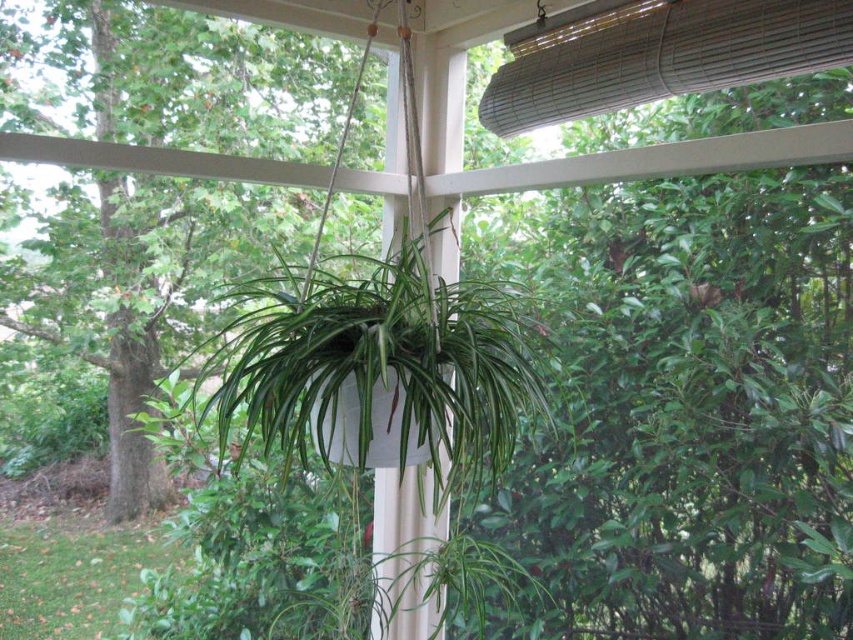
You are standing on the porch and want to hang a new wind chime between the green leafy tree at center and the bamboo blind at upper center. The wind chime requires 6 feet of space to hang properly. Is there enough space between them to install it?

The distance between the green leafy tree at center and the bamboo blind at upper center is 7.28 feet, which is more than the required 6 feet. Therefore, there is enough space to install the wind chime between them.

You are a gardener who wants to ensure the green matte hanging plant at center doesn not obstruct the view through the bamboo blind at upper center. Based on their sizes, is there a risk that the plant might block the blind?

The green matte hanging plant at center has a greater height compared to bamboo blind at upper center, so there is a risk that the plant might block the blind.

You are standing on the porch and want to water the green leafy tree at center and the green matte hanging plant at center. Which one is closer to the left side of the porch?

The green leafy tree at center is positioned on the left side of green matte hanging plant at center, so it is closer to the left side of the porch.